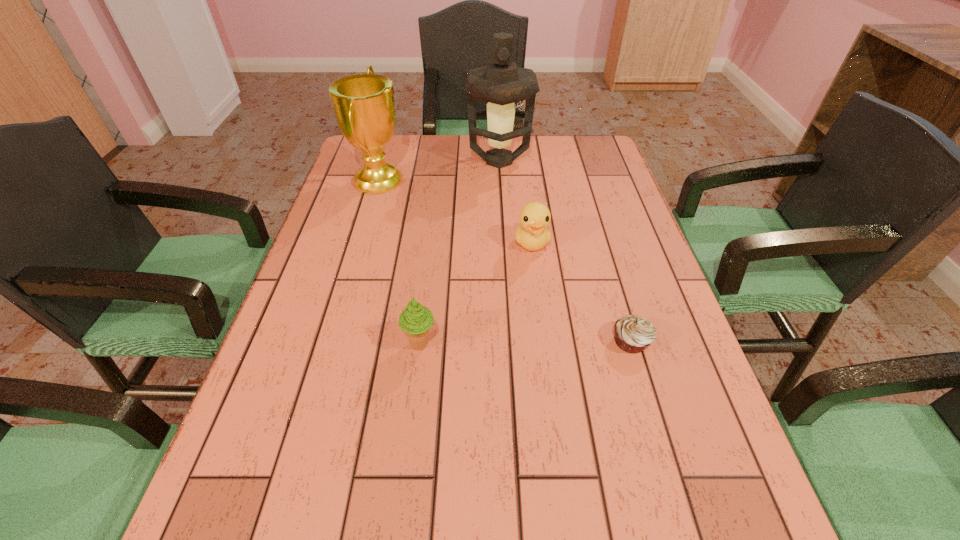
Image resolution: width=960 pixels, height=540 pixels. What are the coordinates of `the tallest object` in the screenshot? It's located at (501, 83).

This screenshot has height=540, width=960. Identify the location of the second tallest object. (363, 104).

In order to click on award in this screenshot , I will do `click(363, 104)`.

The height and width of the screenshot is (540, 960). What are the coordinates of `icecream` in the screenshot? It's located at (415, 321).

Where is `the fourth tallest object`? The height and width of the screenshot is (540, 960). the fourth tallest object is located at coordinates (532, 234).

Find the location of a particular element. Image resolution: width=960 pixels, height=540 pixels. the third farthest object is located at coordinates (532, 234).

The image size is (960, 540). I want to click on the shortest object, so click(x=633, y=334).

Locate an element on the screen. This screenshot has height=540, width=960. muffin is located at coordinates tap(633, 334).

Identify the location of vacant space situated 0.120m on the right of the oil lamp. (568, 161).

Where is `vacant space located on the shiny surface of the fourth shortest object`? This screenshot has height=540, width=960. vacant space located on the shiny surface of the fourth shortest object is located at coordinates pos(482,179).